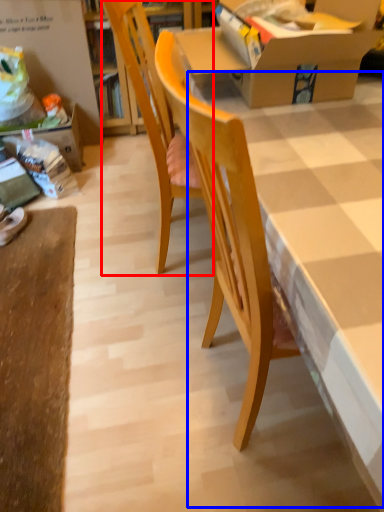
Question: Which of the following is the farthest to the observer, chair (highlighted by a red box) or table (highlighted by a blue box)?

Choices:
 (A) chair
 (B) table

Answer: (A)